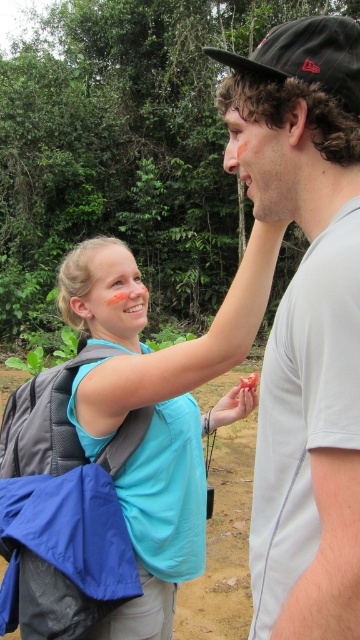
You are trying to locate the gray fabric backpack at upper left. Based on the scene, where would you find it relative to the blue fabric backpack at left?

The gray fabric backpack at upper left is to the left of the blue fabric backpack at left.

You are a photographer standing at point (308,561). You want to take a photo of the two people in the forest scene. Can you fit both of them in your frame if your camera has a 60 cm wide lens?

The two people are 84.15 centimeters apart. Since the camera lens is only 60 cm wide, it cannot capture both of them in the frame as they are farther apart than the lens width.